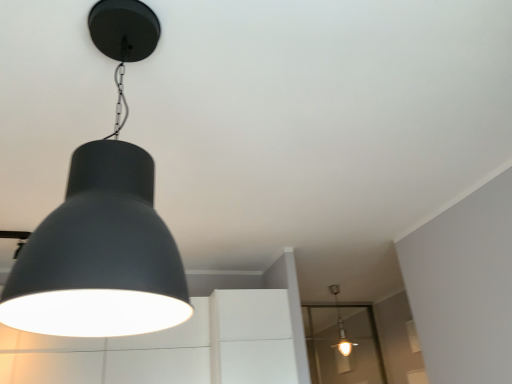
Question: Is matte white bulb at center, placed as the first lamp when sorted from right to left, outside of matte black lampshade at upper left, positioned as the first lamp in front-to-back order?

Choices:
 (A) no
 (B) yes

Answer: (B)

Question: From the image's perspective, is matte white bulb at center, which is counted as the first lamp, starting from the back, over matte black lampshade at upper left, the 1th lamp positioned from the top?

Choices:
 (A) yes
 (B) no

Answer: (B)

Question: Can you confirm if matte white bulb at center, which is counted as the first lamp, starting from the bottom, is thinner than matte black lampshade at upper left, the 1th lamp positioned from the top?

Choices:
 (A) yes
 (B) no

Answer: (A)

Question: Is matte white bulb at center, placed as the first lamp when sorted from right to left, next to matte black lampshade at upper left, the second lamp ordered from the bottom, and touching it?

Choices:
 (A) no
 (B) yes

Answer: (A)

Question: Can matte black lampshade at upper left, positioned as the 2th lamp in back-to-front order, be found inside matte white bulb at center, placed as the first lamp when sorted from right to left?

Choices:
 (A) yes
 (B) no

Answer: (B)

Question: Which is correct: matte white bulb at center, which is counted as the first lamp, starting from the back, is inside transparent glass door at lower right, or outside of it?

Choices:
 (A) outside
 (B) inside

Answer: (A)

Question: Relative to transparent glass door at lower right, is matte white bulb at center, the second lamp from the top, in front or behind?

Choices:
 (A) behind
 (B) front

Answer: (B)

Question: Based on their positions, is matte white bulb at center, placed as the first lamp when sorted from right to left, located to the left or right of transparent glass door at lower right?

Choices:
 (A) right
 (B) left

Answer: (B)

Question: From the image's perspective, relative to transparent glass door at lower right, is matte white bulb at center, the 2th lamp in the front-to-back sequence, above or below?

Choices:
 (A) below
 (B) above

Answer: (B)

Question: From the image's perspective, is transparent glass door at lower right positioned above or below matte black lampshade at upper left, the second lamp ordered from the bottom?

Choices:
 (A) below
 (B) above

Answer: (A)

Question: Considering the positions of transparent glass door at lower right and matte black lampshade at upper left, the 1th lamp in the left-to-right sequence, in the image, is transparent glass door at lower right wider or thinner than matte black lampshade at upper left, the 1th lamp in the left-to-right sequence,?

Choices:
 (A) wide
 (B) thin

Answer: (B)

Question: Would you say transparent glass door at lower right is to the left or to the right of matte black lampshade at upper left, the 1th lamp positioned from the top, in the picture?

Choices:
 (A) right
 (B) left

Answer: (A)

Question: From a real-world perspective, is transparent glass door at lower right above or below matte black lampshade at upper left, the 1th lamp in the left-to-right sequence?

Choices:
 (A) above
 (B) below

Answer: (A)

Question: Would you say matte black lampshade at upper left, the 1th lamp positioned from the top, is to the left or to the right of matte white bulb at center, which is counted as the first lamp, starting from the bottom, in the picture?

Choices:
 (A) right
 (B) left

Answer: (B)

Question: From the image's perspective, is matte black lampshade at upper left, positioned as the first lamp in front-to-back order, located above or below matte white bulb at center, the 2th lamp in the front-to-back sequence?

Choices:
 (A) below
 (B) above

Answer: (B)